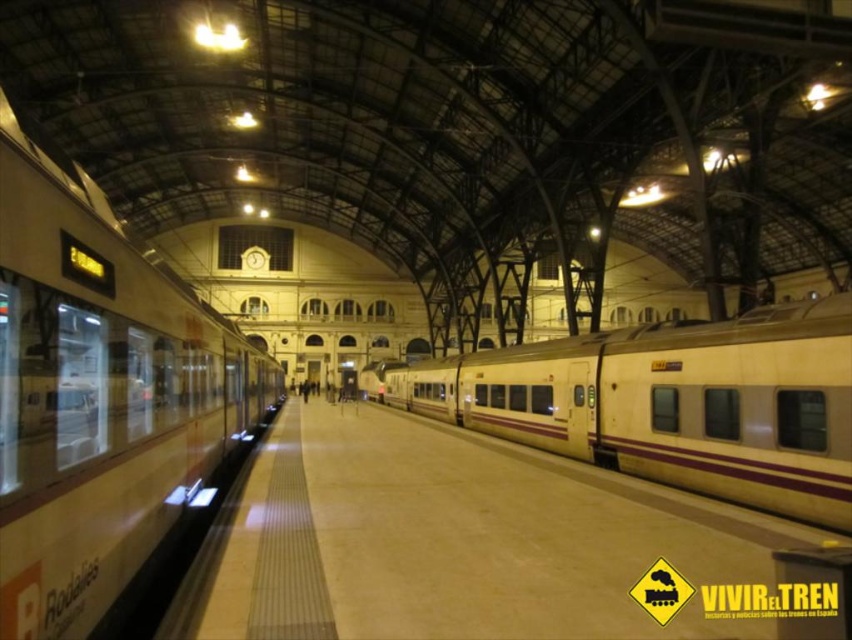
Question: Which of the following is the farthest from the observer?

Choices:
 (A) yellow/smooth train at center
 (B) matte beige train at center
 (C) matte beige train at left

Answer: (B)

Question: Estimate the real-world distances between objects in this image. Which object is farther from the matte beige train at center?

Choices:
 (A) matte beige train at left
 (B) yellow/smooth train at center

Answer: (A)

Question: Which of the following is the farthest from the observer?

Choices:
 (A) (213, 467)
 (B) (829, 595)
 (C) (718, 381)

Answer: (A)

Question: Can you confirm if yellow/smooth train at center is smaller than matte beige train at center?

Choices:
 (A) no
 (B) yes

Answer: (B)

Question: Is the position of yellow/smooth train at center less distant than that of matte beige train at left?

Choices:
 (A) no
 (B) yes

Answer: (A)

Question: Is matte beige train at left bigger than matte beige train at center?

Choices:
 (A) yes
 (B) no

Answer: (B)